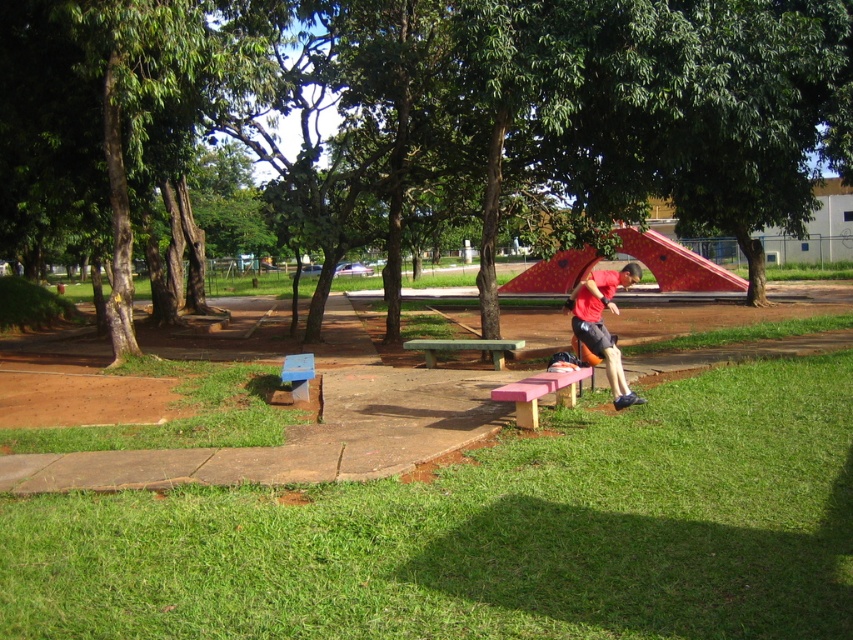
Where is `pink wood bench at lower center`? The height and width of the screenshot is (640, 853). pink wood bench at lower center is located at coordinates (540, 392).

Is pink wood bench at lower center below green wooden bench at center?

Yes.

Does point (497, 392) lie behind point (428, 353)?

No, (497, 392) is closer to viewer.

What are the coordinates of `pink wood bench at lower center` in the screenshot? It's located at [540, 392].

Can you confirm if green leafy tree at center is bigger than blue plastic bench at lower left?

Yes, green leafy tree at center is bigger than blue plastic bench at lower left.

Does green leafy tree at center have a greater height compared to blue plastic bench at lower left?

Yes, green leafy tree at center is taller than blue plastic bench at lower left.

You are a GUI agent. You are given a task and a screenshot of the screen. Output one action in this format:
    pyautogui.click(x=<x>, y=<y>)
    Task: Click on the green leafy tree at center
    This screenshot has width=853, height=640.
    Given the screenshot: What is the action you would take?
    pyautogui.click(x=424, y=115)

Does matte red shirt at center appear under blue plastic bench at lower left?

Incorrect, matte red shirt at center is not positioned below blue plastic bench at lower left.

Between matte red shirt at center and blue plastic bench at lower left, which one has less height?

With less height is blue plastic bench at lower left.

Find the location of a particular element. The image size is (853, 640). matte red shirt at center is located at coordinates (602, 323).